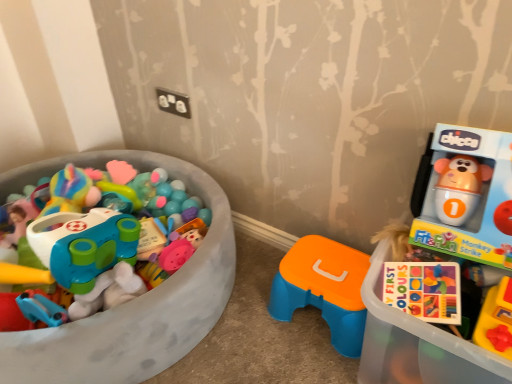
In order to click on empty space that is ontop of orange plastic stool at center, the first toy positioned from the right (from a real-world perspective) in this screenshot , I will do pos(332,268).